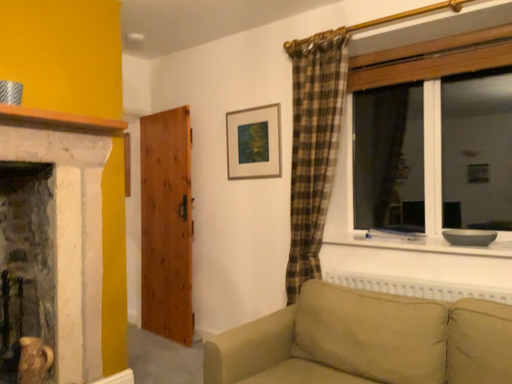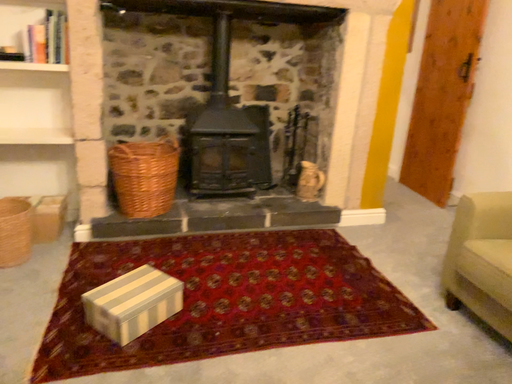
Question: How did the camera likely rotate when shooting the video?

Choices:
 (A) rotated downward
 (B) rotated upward

Answer: (A)